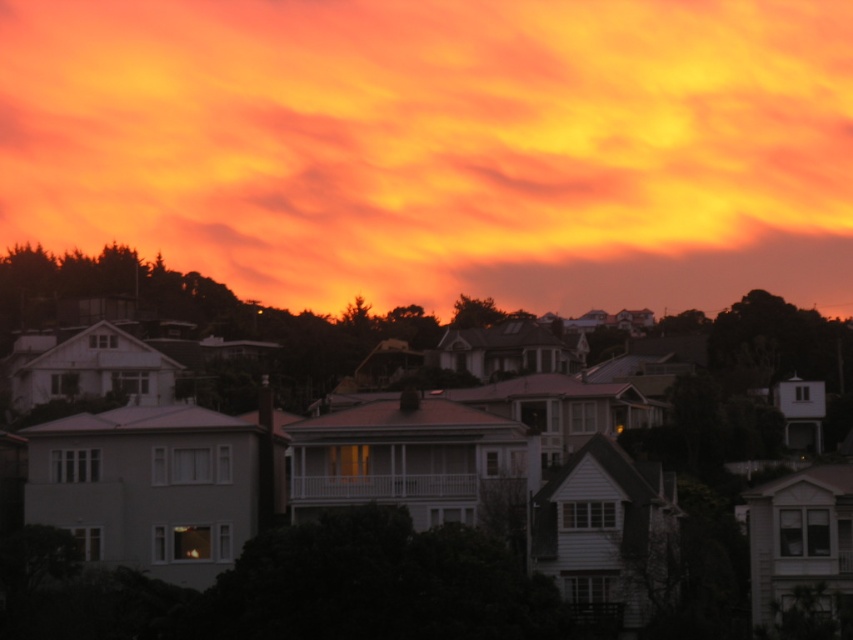
Does orange/yellow cloud at upper center have a greater width compared to white matte house at center?

Indeed, orange/yellow cloud at upper center has a greater width compared to white matte house at center.

Find the location of a particular element. This screenshot has height=640, width=853. orange/yellow cloud at upper center is located at coordinates (440, 147).

The image size is (853, 640). Find the location of `orange/yellow cloud at upper center`. orange/yellow cloud at upper center is located at coordinates (440, 147).